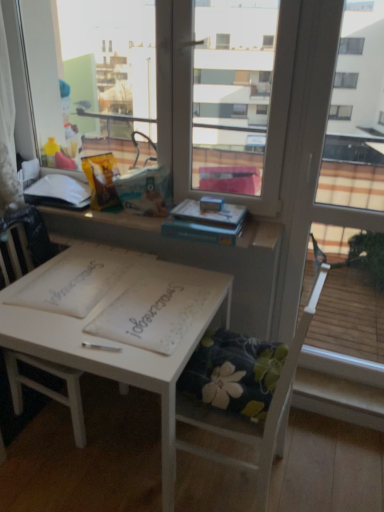
This screenshot has height=512, width=384. I want to click on vacant space underneath white paper notebook at center, which appears as the second notebook when viewed from the left (from a real-world perspective), so click(x=153, y=306).